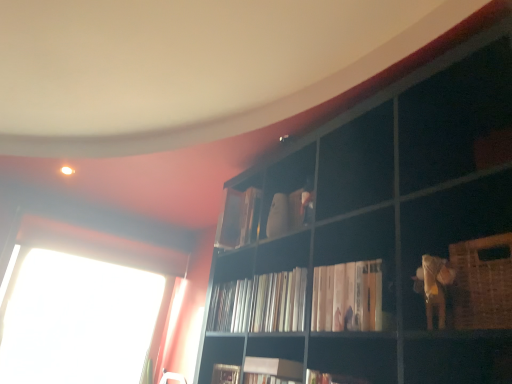
Question: Is white glossy books at center in front of or behind matte white book at upper center, which is the first book in back-to-front order, in the image?

Choices:
 (A) behind
 (B) front

Answer: (B)

Question: From a real-world perspective, is white glossy books at center physically located above or below matte white book at upper center, the 4th book when ordered from front to back?

Choices:
 (A) above
 (B) below

Answer: (B)

Question: Based on their relative distances, which object is farther from the white glossy books at center?

Choices:
 (A) woven brown basket at lower right
 (B) white paper book at center, placed as the third book when sorted from front to back
 (C) white matte book at center, the fourth book viewed from the back
 (D) matte white book at upper center, which is the first book in back-to-front order
 (E) white matte bookshelf at center, the 3th book positioned from the back

Answer: (A)

Question: Based on their relative distances, which object is farther from the white glossy books at center?

Choices:
 (A) white matte bookshelf at center, the 3th book positioned from the back
 (B) woven brown basket at lower right
 (C) matte white book at upper center, the 4th book when ordered from front to back
 (D) white matte book at center, which is the first book in front-to-back order
 (E) white paper book at center, placed as the third book when sorted from front to back

Answer: (B)